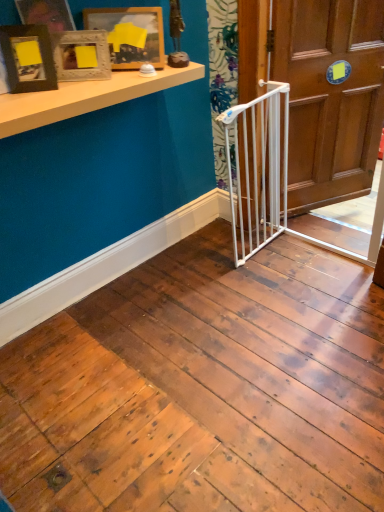
Question: Considering the positions of point (160, 36) and point (296, 112), is point (160, 36) closer or farther from the camera than point (296, 112)?

Choices:
 (A) farther
 (B) closer

Answer: (B)

Question: Is matte wooden picture frame at upper left, which is the first picture frame from back to front, bigger or smaller than white wooden door at center?

Choices:
 (A) big
 (B) small

Answer: (B)

Question: Based on their relative distances, which object is farther from the matte wooden picture frame at upper left, which is the first picture frame from back to front?

Choices:
 (A) woodenobject at upper left, which appears as the 2th picture frame when viewed from the back
 (B) white wooden door at center
 (C) white plastic gate at center
 (D) matte black picture frame at upper left, the first picture frame in the front-to-back sequence
 (E) white matte shelf at upper left

Answer: (B)

Question: Estimate the real-world distances between objects in this image. Which object is farther from the white matte shelf at upper left?

Choices:
 (A) matte black picture frame at upper left, the 3th picture frame in the back-to-front sequence
 (B) matte wooden picture frame at upper left, which is the first picture frame from back to front
 (C) white plastic gate at center
 (D) woodenobject at upper left, which appears as the 2th picture frame when viewed from the back
 (E) white wooden door at center

Answer: (E)